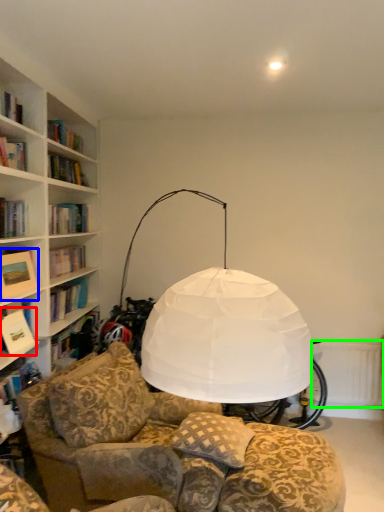
Question: Estimate the real-world distances between objects in this image. Which object is closer to book (highlighted by a red box), picture frame (highlighted by a blue box) or radiator (highlighted by a green box)?

Choices:
 (A) picture frame
 (B) radiator

Answer: (A)